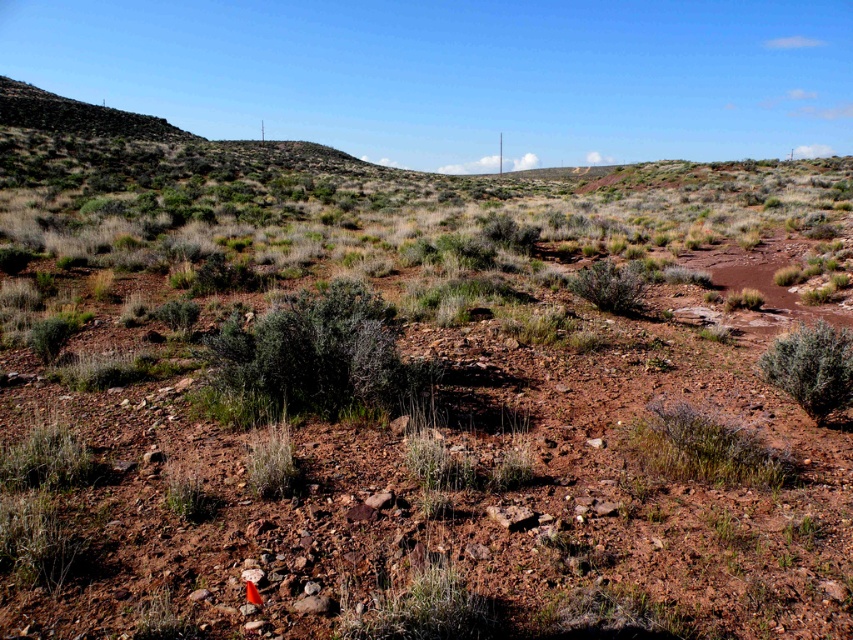
Based on the photo, can you confirm if green shrub at center is bigger than green fuzzy bush at right?

Correct, green shrub at center is larger in size than green fuzzy bush at right.

Is green shrub at center in front of green fuzzy bush at right?

No, green shrub at center is further to the viewer.

Between point (294, 388) and point (813, 396), which one is positioned in front?

Positioned in front is point (813, 396).

Where is `green shrub at center`? This screenshot has height=640, width=853. green shrub at center is located at coordinates (312, 358).